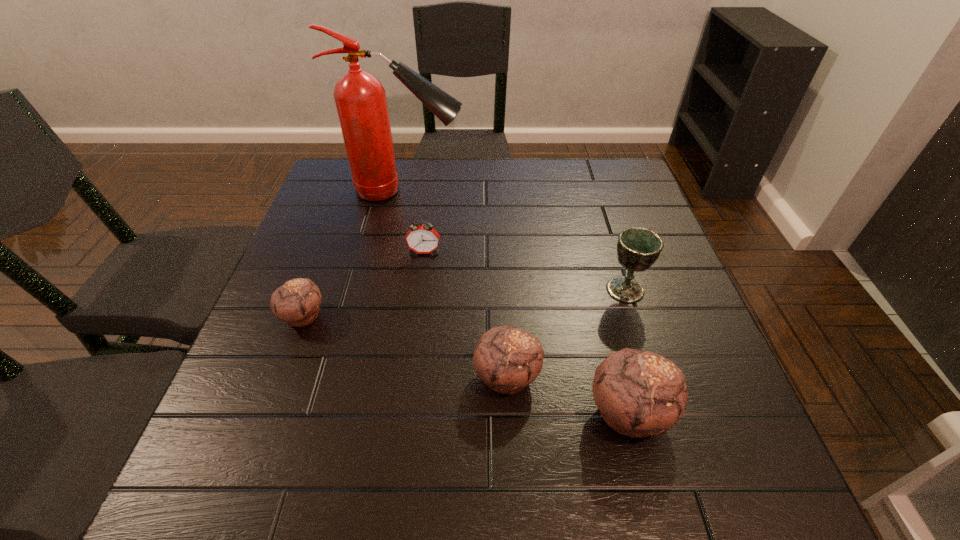
Find the location of a particular element. The height and width of the screenshot is (540, 960). the leftmost muffin is located at coordinates (297, 302).

This screenshot has height=540, width=960. I want to click on the shortest muffin, so click(297, 302).

Locate an element on the screen. This screenshot has height=540, width=960. the second shortest muffin is located at coordinates (507, 359).

Find the location of a particular element. This screenshot has height=540, width=960. the second muffin from right to left is located at coordinates (507, 359).

Image resolution: width=960 pixels, height=540 pixels. What are the coordinates of `the tallest muffin` in the screenshot? It's located at (639, 393).

You are a GUI agent. You are given a task and a screenshot of the screen. Output one action in this format:
    pyautogui.click(x=<x>, y=<y>)
    Task: Click on the tallest object
    The width and height of the screenshot is (960, 540).
    Given the screenshot: What is the action you would take?
    pyautogui.click(x=360, y=99)

Locate an element on the screen. fire extinguisher is located at coordinates (360, 99).

Locate an element on the screen. The width and height of the screenshot is (960, 540). the second farthest object is located at coordinates (423, 239).

Identify the location of chalice. (638, 248).

You are a GUI agent. You are given a task and a screenshot of the screen. Output one action in this format:
    pyautogui.click(x=<x>, y=<y>)
    Task: Click on the blank space located 0.210m on the right of the shortest muffin
    This screenshot has height=540, width=960.
    Given the screenshot: What is the action you would take?
    pyautogui.click(x=425, y=316)